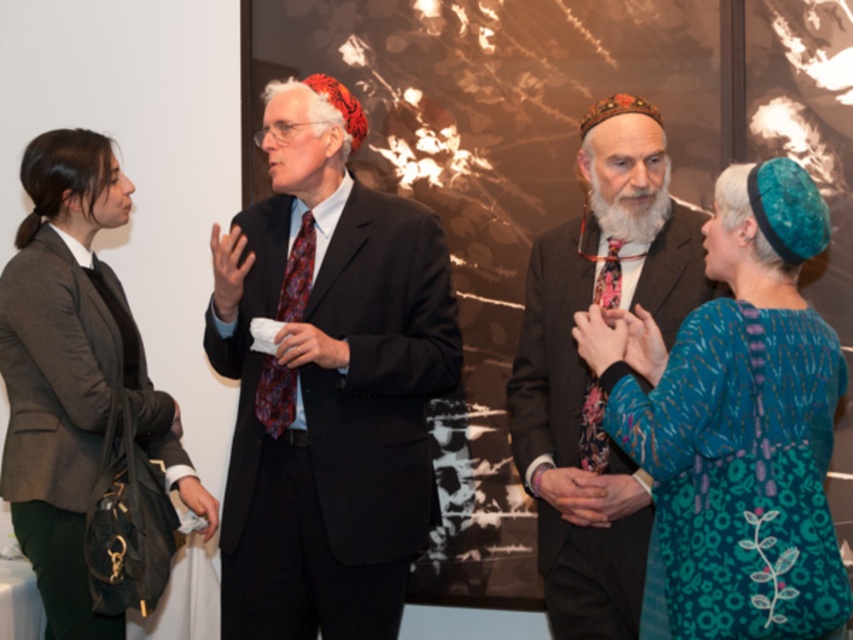
Between point (576, 554) and point (80, 266), which one is positioned behind?

Positioned behind is point (80, 266).

Between brown textured suit at center and dark gray fabric blazer at left, which one appears on the right side from the viewer's perspective?

brown textured suit at center is more to the right.

The height and width of the screenshot is (640, 853). What do you see at coordinates (589, 371) in the screenshot?
I see `brown textured suit at center` at bounding box center [589, 371].

You are a GUI agent. You are given a task and a screenshot of the screen. Output one action in this format:
    pyautogui.click(x=<x>, y=<y>)
    Task: Click on the brown textured suit at center
    This screenshot has width=853, height=640.
    Given the screenshot: What is the action you would take?
    pyautogui.click(x=589, y=371)

Is point (331, 237) farther from camera compared to point (598, 225)?

Yes, it is.

Image resolution: width=853 pixels, height=640 pixels. In order to click on matte black suit at center in this screenshot , I will do pos(326,381).

Can you confirm if teal floral dress at center is thinner than white soft beard at center?

In fact, teal floral dress at center might be wider than white soft beard at center.

Does teal floral dress at center appear under white soft beard at center?

Indeed, teal floral dress at center is positioned under white soft beard at center.

Does point (694, 310) come closer to viewer compared to point (659, 216)?

That is True.

I want to click on teal floral dress at center, so click(735, 422).